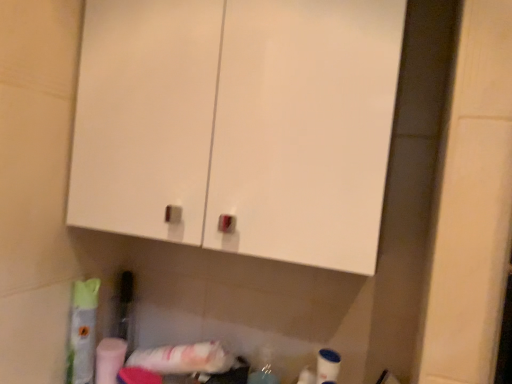
Question: In terms of height, does white glossy cabinet at upper center look taller or shorter compared to white matte toilet paper at lower left?

Choices:
 (A) tall
 (B) short

Answer: (A)

Question: Is white glossy cabinet at upper center inside or outside of white matte toilet paper at lower left?

Choices:
 (A) outside
 (B) inside

Answer: (A)

Question: Is point [348, 102] closer or farther from the camera than point [112, 382]?

Choices:
 (A) farther
 (B) closer

Answer: (B)

Question: Is white matte toilet paper at lower left wider or thinner than white glossy cabinet at upper center?

Choices:
 (A) wide
 (B) thin

Answer: (B)

Question: Which is correct: white matte toilet paper at lower left is inside white glossy cabinet at upper center, or outside of it?

Choices:
 (A) inside
 (B) outside

Answer: (B)

Question: Does point (114, 355) appear closer or farther from the camera than point (300, 178)?

Choices:
 (A) farther
 (B) closer

Answer: (A)

Question: In the image, is white matte toilet paper at lower left positioned in front of or behind white glossy cabinet at upper center?

Choices:
 (A) front
 (B) behind

Answer: (B)